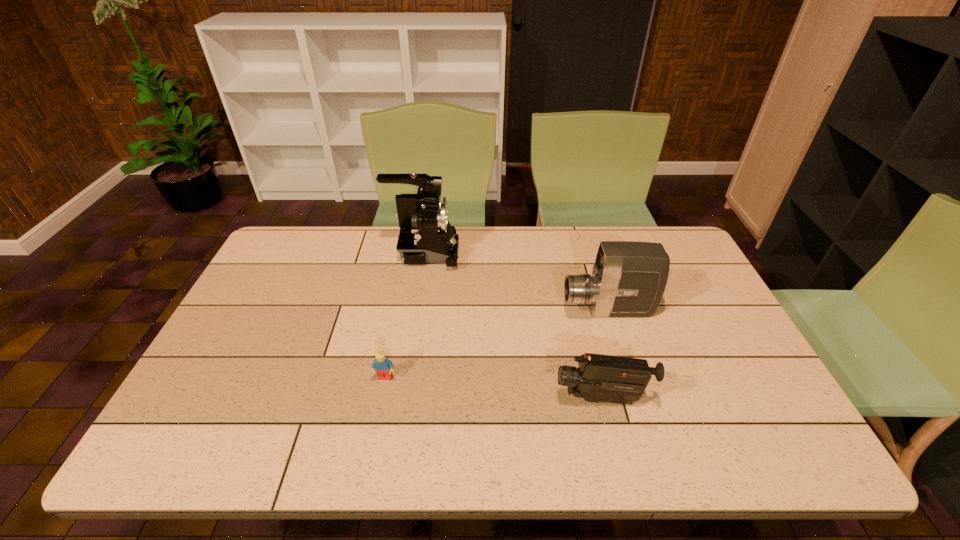
Identify the location of vacant region at the right edge of the desktop. (684, 320).

This screenshot has height=540, width=960. In the image, there is a desktop. Find the location of `vacant space at the far left corner`. vacant space at the far left corner is located at coordinates (267, 260).

In order to click on vacant space at the far right corner in this screenshot , I will do `click(667, 245)`.

The image size is (960, 540). In order to click on vacant space that is in between the Lego and the second shortest object in this screenshot , I will do [493, 388].

Find the location of `unoccupied area between the second tallest object and the farthest camcorder`. unoccupied area between the second tallest object and the farthest camcorder is located at coordinates tap(516, 281).

Locate an element on the screen. free area in between the tallest object and the second nearest camcorder is located at coordinates (516, 281).

Where is `free area in between the shortest camcorder and the leftmost camcorder`? The image size is (960, 540). free area in between the shortest camcorder and the leftmost camcorder is located at coordinates (513, 326).

I want to click on vacant space that's between the tallest object and the nearest camcorder, so click(x=513, y=326).

Locate an element on the screen. Image resolution: width=960 pixels, height=540 pixels. vacant space that is in between the tallest object and the third tallest object is located at coordinates (513, 326).

Find the location of `vacant area that lies between the second tallest object and the farthest object`. vacant area that lies between the second tallest object and the farthest object is located at coordinates (516, 281).